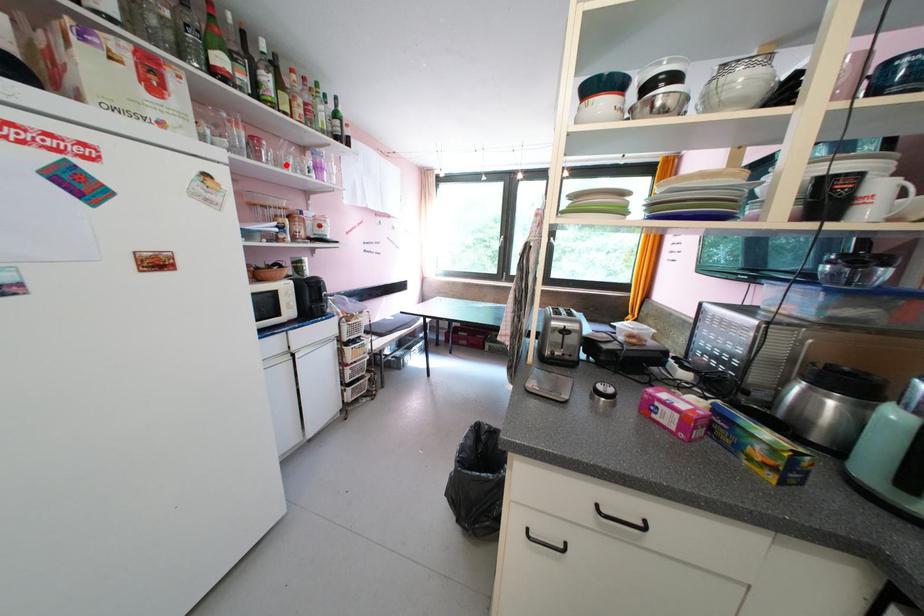
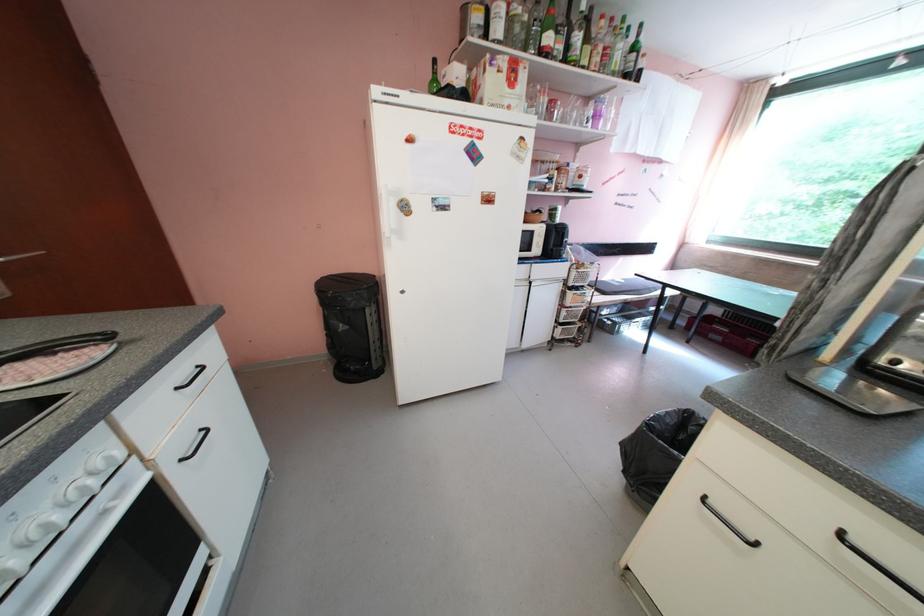
Locate, in the second image, the point that corresponds to the highlighted location in the first image.

(572, 122)